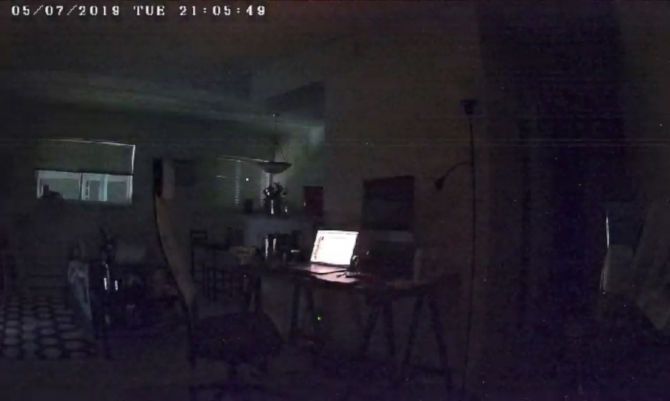
At what (x,y) coordinates should I click in order to perform the action: click on chair. Please return your answer as a coordinate pair (x, y). Looking at the image, I should click on (175, 268).